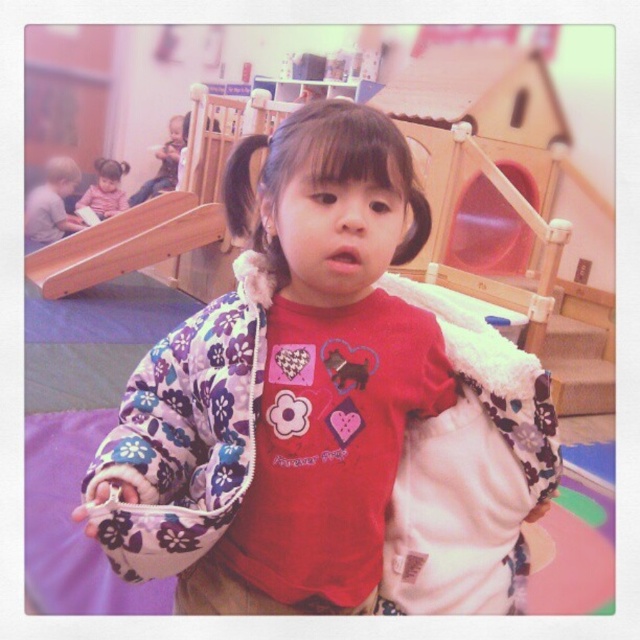
You are a photographer trying to capture a clear shot of the black silky hair at center and the matte pink shirt at upper left. Which object should you focus on first to ensure both are in focus?

The black silky hair at center is in front of the matte pink shirt at upper left, so you should focus on the black silky hair at center first to ensure both are in focus.

You are a photographer trying to capture a group photo of the black silky hair at center and the matte pink shirt at upper left. To ensure both are in the frame, which direction should you move the camera? Specify left or right.

The black silky hair at center is to the right of the matte pink shirt at upper left, so you should move the camera to the left to include both in the frame.